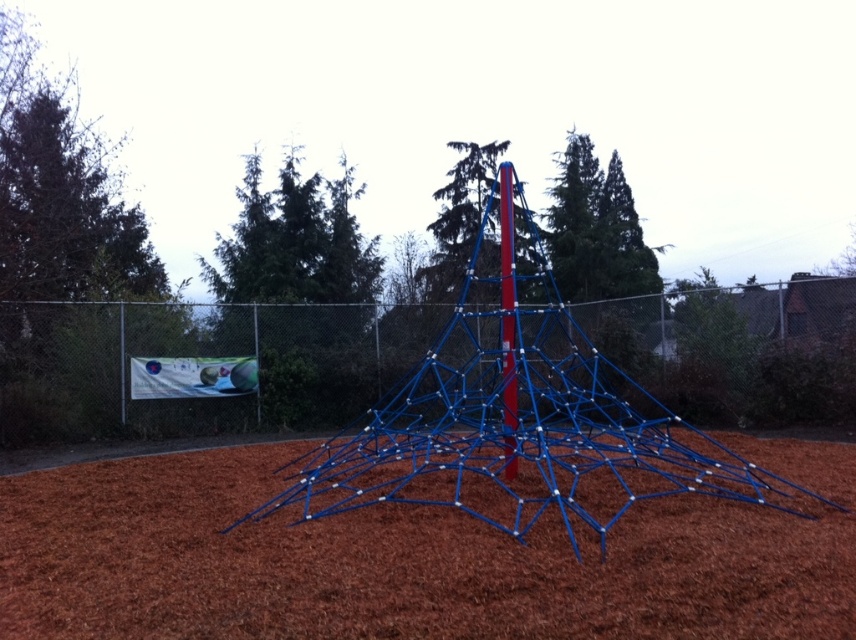
Question: Based on their relative distances, which object is farther from the blue metallic pole at center?

Choices:
 (A) brown mulch at center
 (B) blue metallic climbing frame at center

Answer: (B)

Question: Is brown mulch at center smaller than blue metallic climbing frame at center?

Choices:
 (A) yes
 (B) no

Answer: (A)

Question: Which of these objects is positioned closest to the brown mulch at center?

Choices:
 (A) blue metallic climbing frame at center
 (B) blue metallic pole at center

Answer: (A)

Question: Is brown mulch at center smaller than blue metallic pole at center?

Choices:
 (A) no
 (B) yes

Answer: (A)

Question: Where is blue metallic climbing frame at center located in relation to blue metallic pole at center in the image?

Choices:
 (A) above
 (B) below

Answer: (B)

Question: Which object is closer to the camera taking this photo?

Choices:
 (A) blue metallic climbing frame at center
 (B) blue metallic pole at center

Answer: (A)